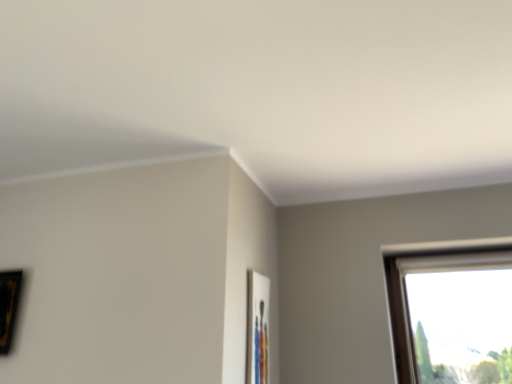
Question: In terms of height, does wooden picture frame at left, the 1th picture frame from the left, look taller or shorter compared to matte wooden picture frame at center-right, marked as the 1th picture frame in a right-to-left arrangement?

Choices:
 (A) short
 (B) tall

Answer: (A)

Question: In the image, is wooden picture frame at left, which is counted as the 2th picture frame, starting from the right, positioned in front of or behind matte wooden picture frame at center-right, marked as the second picture frame in a left-to-right arrangement?

Choices:
 (A) behind
 (B) front

Answer: (A)

Question: Based on their sizes in the image, would you say wooden picture frame at left, which is counted as the 2th picture frame, starting from the right, is bigger or smaller than matte wooden picture frame at center-right, marked as the 1th picture frame in a right-to-left arrangement?

Choices:
 (A) big
 (B) small

Answer: (A)

Question: In terms of height, does matte wooden picture frame at center-right, marked as the 1th picture frame in a right-to-left arrangement, look taller or shorter compared to wooden picture frame at left, the 1th picture frame from the left?

Choices:
 (A) short
 (B) tall

Answer: (B)

Question: Is point (262, 354) closer or farther from the camera than point (3, 278)?

Choices:
 (A) farther
 (B) closer

Answer: (B)

Question: Visually, is matte wooden picture frame at center-right, marked as the second picture frame in a left-to-right arrangement, positioned to the left or to the right of wooden picture frame at left, the 1th picture frame from the left?

Choices:
 (A) right
 (B) left

Answer: (A)

Question: From the image's perspective, is matte wooden picture frame at center-right, marked as the second picture frame in a left-to-right arrangement, above or below wooden picture frame at left, which is counted as the 2th picture frame, starting from the right?

Choices:
 (A) above
 (B) below

Answer: (B)